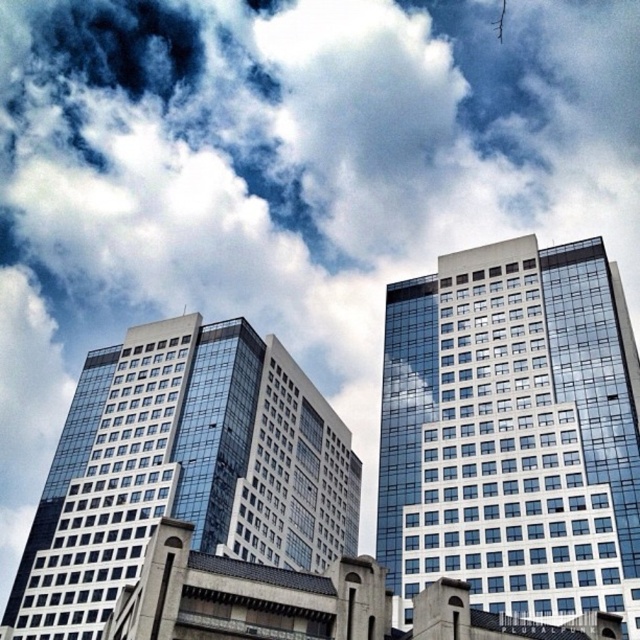
You are an architect analyzing the urban scene. You notice the glassy reflective building at upper center. Can you determine its position relative to the center of the image based on the coordinates provided?

The glassy reflective building at upper center is located at coordinates point [513,433], which places it slightly to the right and above the center of the image.

Looking at this image, you are a drone operator planning to fly a drone between the two glassy reflective buildings in the scene. The drone has a height clearance of 10 meters. Based on their positions, can the drone safely pass between the glassy reflective building at upper center and the glassy reflective building at center?

The glassy reflective building at upper center is in front of the glassy reflective building at center, meaning there is a vertical overlap between them. This would likely leave insufficient vertical space for the drone to pass safely between them at its 10 meter height clearance.

You are an architect analyzing the urban skyline. You observe the glassy reflective building at upper center and the glassy reflective building at center. Which building appears shorter in the image?

The glassy reflective building at upper center appears shorter compared to the glassy reflective building at center as stated in the description.